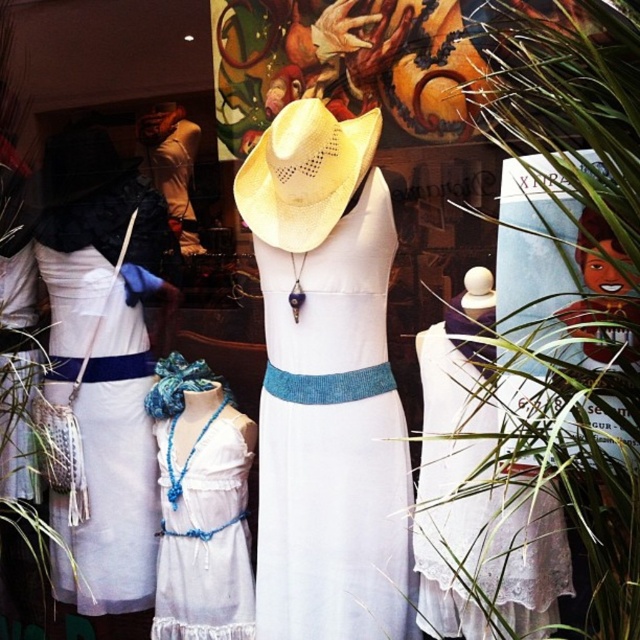
You are a fashion designer observing the display. You need to place a new accessory between the white woven fabric dress at left and the white lace dress at center. Based on their positions, which dress should the accessory be closer to?

The white woven fabric dress at left is positioned on the left side of white lace dress at center, so the accessory should be placed closer to the white woven fabric dress at left to maintain symmetry.

In the scene shown: You are a photographer setting up a shoot in the scene described. You need to ensure that the green leafy plant at center does not block the view of the white lace dress at center. Based on their sizes, can you determine if the plant is large enough to potentially block the dress?

The green leafy plant at center has a larger size compared to white lace dress at center, so it is possible that the plant could block the view of the dress if positioned directly in front of it.